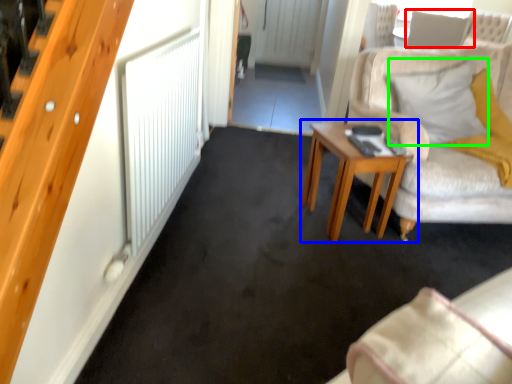
Question: Based on their relative distances, which object is nearer to pillow (highlighted by a red box)? Choose from table (highlighted by a blue box) and pillow (highlighted by a green box).

Choices:
 (A) table
 (B) pillow

Answer: (B)